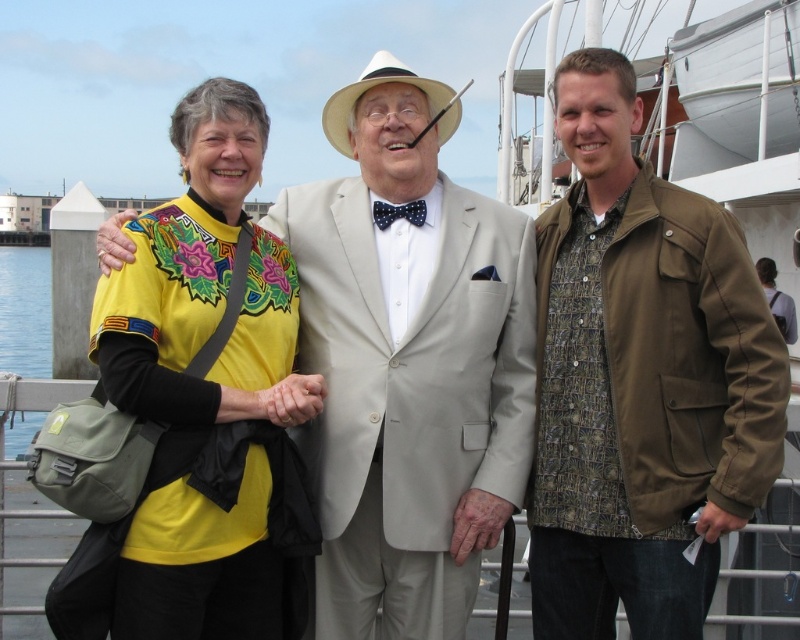
Question: In this image, where is light beige suit at center located relative to white felt cowboy hat at center?

Choices:
 (A) right
 (B) left

Answer: (B)

Question: Which object appears farthest from the camera in this image?

Choices:
 (A) light beige suit at center
 (B) olive-green canvas jacket at right
 (C) matte yellow shirt at center

Answer: (B)

Question: Observing the image, what is the correct spatial positioning of matte yellow shirt at center in reference to blue water at lower left?

Choices:
 (A) above
 (B) below

Answer: (B)

Question: Which point is closer to the camera?

Choices:
 (A) (350, 147)
 (B) (490, 202)
 (C) (112, 336)
 (D) (8, 291)

Answer: (C)

Question: Which point is closer to the camera?

Choices:
 (A) light beige suit at center
 (B) blue water at lower left

Answer: (A)

Question: Can you confirm if olive-green canvas jacket at right is thinner than blue water at lower left?

Choices:
 (A) yes
 (B) no

Answer: (A)